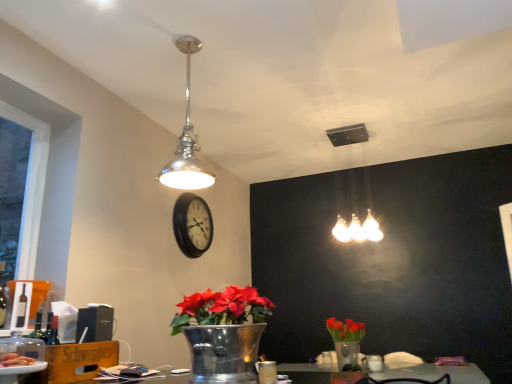
The image size is (512, 384). I want to click on vacant space situated above polished chrome pendant light at upper center, positioned as the 1th lamp in front-to-back order (from a real-world perspective), so click(x=193, y=31).